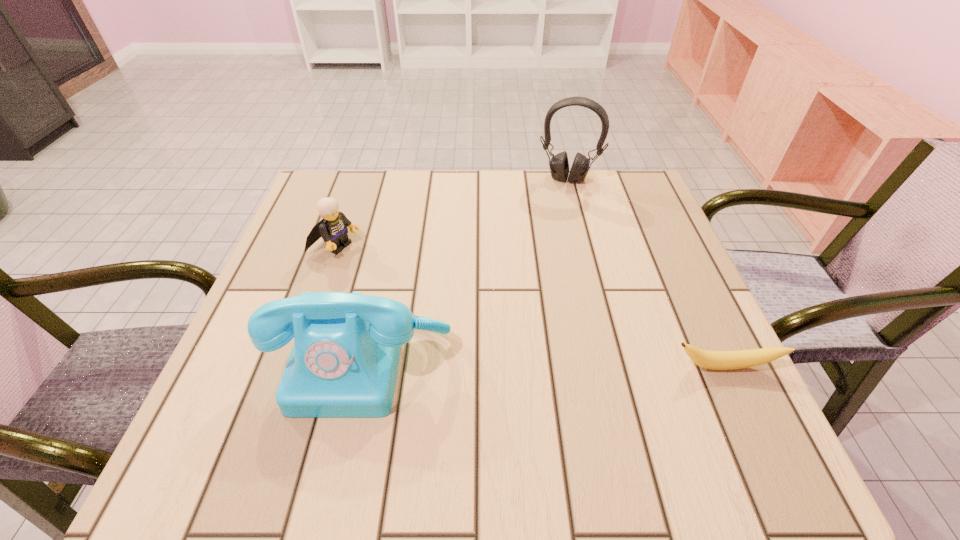
In order to click on vacant space on the desktop that is between the telephone and the banana and is positioned on the front-facing side of the Lego in this screenshot , I will do `click(598, 364)`.

Image resolution: width=960 pixels, height=540 pixels. Identify the location of vacant space on the desktop that is between the telephone and the shortest object and is positioned on the front-facing side of the farthest object. (519, 363).